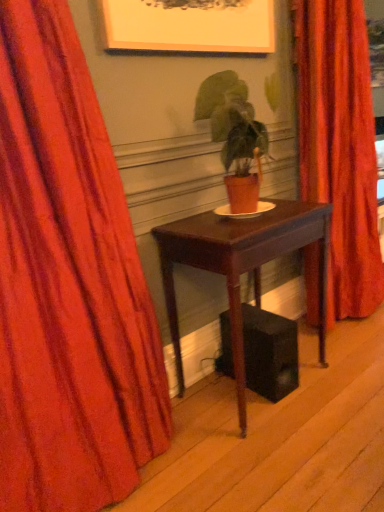
This screenshot has height=512, width=384. I want to click on matte orange pot at center, so (234, 135).

Identify the location of velvet red curtain at left, which ranks as the 1th curtain in left-to-right order. The height and width of the screenshot is (512, 384). (68, 285).

Find the location of a particular element. mahogany wood table at center is located at coordinates (242, 266).

Measure the distance from velvet red curtain at left, which ranks as the first curtain in front-to-back order, to mahogany wood table at center.

A distance of 45.98 centimeters exists between velvet red curtain at left, which ranks as the first curtain in front-to-back order, and mahogany wood table at center.

Would you say velvet red curtain at left, acting as the 2th curtain starting from the back, is to the left or to the right of mahogany wood table at center in the picture?

Clearly, velvet red curtain at left, acting as the 2th curtain starting from the back, is on the left of mahogany wood table at center in the image.

Can you tell me how much velvet red curtain at left, which ranks as the first curtain in front-to-back order, and mahogany wood table at center differ in facing direction?

1.08 degrees separate the facing orientations of velvet red curtain at left, which ranks as the first curtain in front-to-back order, and mahogany wood table at center.

Is velvet red curtain at left, which ranks as the 1th curtain in left-to-right order, beside mahogany wood table at center?

No.

Is matte orange pot at center inside the boundaries of mahogany wood table at center, or outside?

matte orange pot at center lies outside mahogany wood table at center.

From the image's perspective, is matte orange pot at center above mahogany wood table at center?

Correct, matte orange pot at center appears higher than mahogany wood table at center in the image.

Is matte orange pot at center taller than mahogany wood table at center?

In fact, matte orange pot at center may be shorter than mahogany wood table at center.

Is mahogany wood table at center smaller than velvet orange curtain at center, the 2th curtain from the left?

Yes, mahogany wood table at center is smaller than velvet orange curtain at center, the 2th curtain from the left.

Is velvet orange curtain at center, which ranks as the first curtain in right-to-left order, located within mahogany wood table at center?

Definitely not — velvet orange curtain at center, which ranks as the first curtain in right-to-left order, is not inside mahogany wood table at center.

What's the angular difference between mahogany wood table at center and velvet orange curtain at center, the 2th curtain from the left,'s facing directions?

The angle between the facing direction of mahogany wood table at center and the facing direction of velvet orange curtain at center, the 2th curtain from the left, is 0.662 degrees.

There is a mahogany wood table at center. At what (x,y) coordinates should I click in order to perform the action: click on the 2nd curtain above it (from a real-world perspective). Please return your answer as a coordinate pair (x, y). The image size is (384, 512). Looking at the image, I should click on (340, 148).

How different are the orientations of velvet red curtain at left, which is counted as the second curtain, starting from the right, and matte orange pot at center in degrees?

There is a 1.08-degree angle between the facing directions of velvet red curtain at left, which is counted as the second curtain, starting from the right, and matte orange pot at center.

Based on the photo, considering the sizes of objects velvet red curtain at left, which ranks as the first curtain in front-to-back order, and matte orange pot at center in the image provided, who is thinner, velvet red curtain at left, which ranks as the first curtain in front-to-back order, or matte orange pot at center?

With smaller width is matte orange pot at center.

Can we say velvet red curtain at left, which is counted as the second curtain, starting from the right, lies outside matte orange pot at center?

Yes.

Considering the points (108, 285) and (216, 141), which point is in front, point (108, 285) or point (216, 141)?

The point (108, 285) is more forward.

Is velvet orange curtain at center, the 2th curtain from the left, facing towards matte orange pot at center?

No, velvet orange curtain at center, the 2th curtain from the left, is not oriented towards matte orange pot at center.

From a real-world perspective, relative to matte orange pot at center, is velvet orange curtain at center, which ranks as the 1th curtain in back-to-front order, vertically above or below?

From a real-world perspective, velvet orange curtain at center, which ranks as the 1th curtain in back-to-front order, is physically below matte orange pot at center.

Which is more to the right, velvet orange curtain at center, marked as the 2th curtain in a front-to-back arrangement, or matte orange pot at center?

velvet orange curtain at center, marked as the 2th curtain in a front-to-back arrangement.

Between mahogany wood table at center and matte orange pot at center, which one has less height?

matte orange pot at center is shorter.

Could you tell me if mahogany wood table at center is turned towards matte orange pot at center?

No, mahogany wood table at center is not turned towards matte orange pot at center.

Does mahogany wood table at center have a lesser width compared to matte orange pot at center?

In fact, mahogany wood table at center might be wider than matte orange pot at center.

Is mahogany wood table at center located outside matte orange pot at center?

Yes, mahogany wood table at center is located beyond the bounds of matte orange pot at center.

Is velvet orange curtain at center, the 2th curtain from the left, shorter than mahogany wood table at center?

No.

Which of these two, velvet orange curtain at center, marked as the 2th curtain in a front-to-back arrangement, or mahogany wood table at center, is smaller?

mahogany wood table at center is smaller.

From a real-world perspective, is velvet orange curtain at center, the 2th curtain from the left, located higher than mahogany wood table at center?

Yes, from a real-world perspective, velvet orange curtain at center, the 2th curtain from the left, is above mahogany wood table at center.

Consider the image. Who is more distant, velvet orange curtain at center, which ranks as the first curtain in right-to-left order, or mahogany wood table at center?

velvet orange curtain at center, which ranks as the first curtain in right-to-left order, is behind.

From the image's perspective, starting from the mahogany wood table at center, which curtain is the 1st one above? Please provide its 2D coordinates.

[(68, 285)]

Find the location of a particular element. This screenshot has height=512, width=384. table that appears below the matte orange pot at center (from a real-world perspective) is located at coordinates (242, 266).

Looking at the image, which one is located closer to velvet red curtain at left, which ranks as the 1th curtain in left-to-right order, matte orange pot at center or mahogany wood table at center?

Among the two, mahogany wood table at center is located nearer to velvet red curtain at left, which ranks as the 1th curtain in left-to-right order.

From the image, which object appears to be farther from velvet red curtain at left, which ranks as the first curtain in front-to-back order, mahogany wood table at center or velvet orange curtain at center, the 2th curtain from the left?

The object further to velvet red curtain at left, which ranks as the first curtain in front-to-back order, is velvet orange curtain at center, the 2th curtain from the left.

Which object lies further to the anchor point velvet orange curtain at center, the 2th curtain from the left, mahogany wood table at center or velvet red curtain at left, which ranks as the first curtain in front-to-back order?

Based on the image, velvet red curtain at left, which ranks as the first curtain in front-to-back order, appears to be further to velvet orange curtain at center, the 2th curtain from the left.

Considering their positions, is velvet red curtain at left, which is counted as the second curtain, starting from the right, positioned closer to matte orange pot at center than velvet orange curtain at center, which ranks as the first curtain in right-to-left order?

velvet orange curtain at center, which ranks as the first curtain in right-to-left order.

Looking at this image, which object lies nearer to the anchor point matte orange pot at center, velvet red curtain at left, which is counted as the second curtain, starting from the right, or mahogany wood table at center?

Among the two, mahogany wood table at center is located nearer to matte orange pot at center.

Which object lies further to the anchor point velvet orange curtain at center, which ranks as the 1th curtain in back-to-front order, velvet red curtain at left, acting as the 2th curtain starting from the back, or matte orange pot at center?

Based on the image, velvet red curtain at left, acting as the 2th curtain starting from the back, appears to be further to velvet orange curtain at center, which ranks as the 1th curtain in back-to-front order.

Looking at the image, which one is located further to velvet orange curtain at center, which ranks as the first curtain in right-to-left order, matte orange pot at center or velvet red curtain at left, which ranks as the 1th curtain in left-to-right order?

The object further to velvet orange curtain at center, which ranks as the first curtain in right-to-left order, is velvet red curtain at left, which ranks as the 1th curtain in left-to-right order.

Estimate the real-world distances between objects in this image. Which object is closer to velvet red curtain at left, which is counted as the second curtain, starting from the right, velvet orange curtain at center, marked as the 2th curtain in a front-to-back arrangement, or mahogany wood table at center?

Based on the image, mahogany wood table at center appears to be nearer to velvet red curtain at left, which is counted as the second curtain, starting from the right.

Locate an element on the screen. This screenshot has width=384, height=512. table between velvet red curtain at left, acting as the 2th curtain starting from the back, and velvet orange curtain at center, which ranks as the 1th curtain in back-to-front order, from left to right is located at coordinates (242, 266).

Identify the location of houseplant between velvet orange curtain at center, which ranks as the 1th curtain in back-to-front order, and mahogany wood table at center vertically. Image resolution: width=384 pixels, height=512 pixels. (234, 135).

Where is `houseplant between velvet red curtain at left, which ranks as the 1th curtain in left-to-right order, and velvet orange curtain at center, which ranks as the first curtain in right-to-left order, in the horizontal direction`? This screenshot has height=512, width=384. houseplant between velvet red curtain at left, which ranks as the 1th curtain in left-to-right order, and velvet orange curtain at center, which ranks as the first curtain in right-to-left order, in the horizontal direction is located at coordinates (234, 135).

At what (x,y) coordinates should I click in order to perform the action: click on table between velvet red curtain at left, which is counted as the second curtain, starting from the right, and matte orange pot at center, along the z-axis. Please return your answer as a coordinate pair (x, y). The width and height of the screenshot is (384, 512). Looking at the image, I should click on click(x=242, y=266).